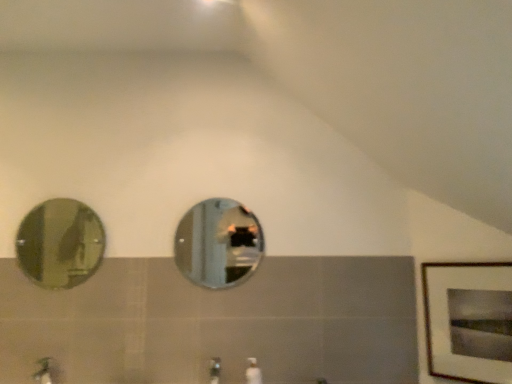
Question: From a real-world perspective, is silver reflective mirror at center, the second mirror from the left, above or below wooden framed print at right?

Choices:
 (A) above
 (B) below

Answer: (A)

Question: Looking at the image, does silver reflective mirror at center, the 1th mirror when ordered from right to left, seem bigger or smaller compared to wooden framed print at right?

Choices:
 (A) small
 (B) big

Answer: (A)

Question: Estimate the real-world distances between objects in this image. Which object is closer to the silver reflective mirror at center, the second mirror from the left?

Choices:
 (A) brushed metal faucet at lower center, the 2th faucet positioned from the left
 (B) green matte faucet at lower left, which appears as the 1th faucet when viewed from the left
 (C) wooden framed print at right
 (D) white glossy soap dispenser at center
 (E) green glass mirror at left, acting as the 1th mirror starting from the left

Answer: (A)

Question: Estimate the real-world distances between objects in this image. Which object is farther from the brushed metal faucet at lower center, the first faucet viewed from the right?

Choices:
 (A) green glass mirror at left, acting as the 1th mirror starting from the left
 (B) silver reflective mirror at center, the second mirror from the left
 (C) wooden framed print at right
 (D) white glossy soap dispenser at center
 (E) green matte faucet at lower left, positioned as the 2th faucet in right-to-left order

Answer: (A)